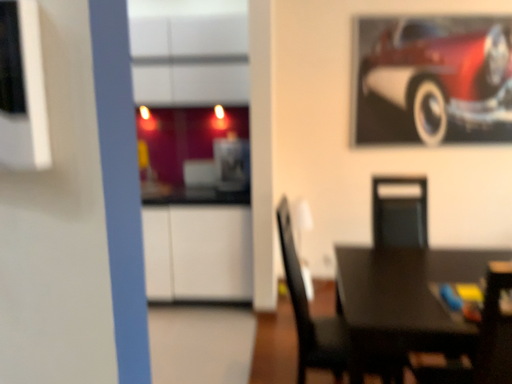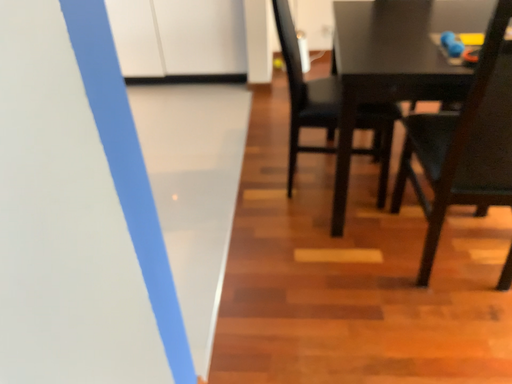
Question: Which way did the camera rotate in the video?

Choices:
 (A) rotated downward
 (B) rotated upward

Answer: (A)